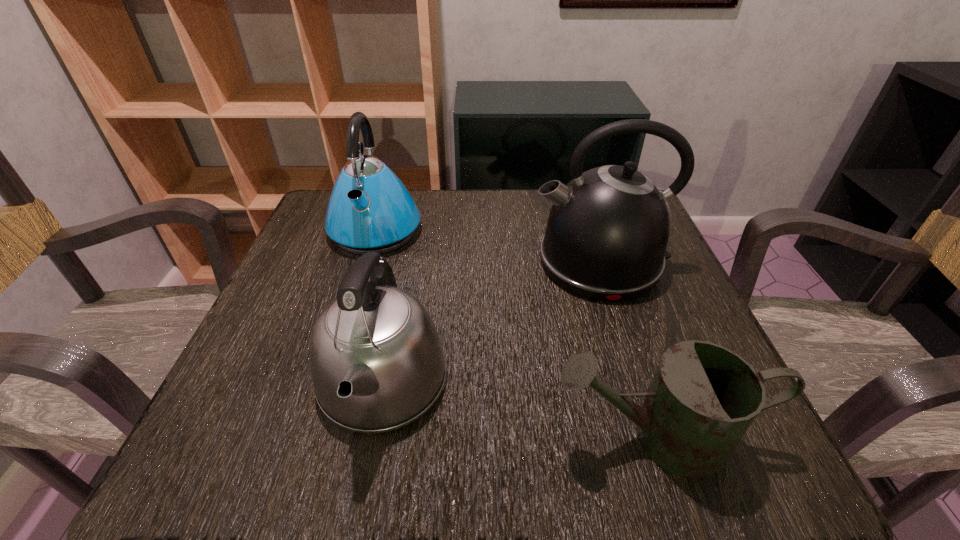
The width and height of the screenshot is (960, 540). In the image, there is a desktop. Find the location of `free space at the near left corner`. free space at the near left corner is located at coordinates (248, 423).

In the image, there is a desktop. Where is `free space at the near right corner`? The width and height of the screenshot is (960, 540). free space at the near right corner is located at coordinates (753, 440).

This screenshot has height=540, width=960. I want to click on free spot between the shortest object and the rightmost kettle, so click(x=628, y=349).

I want to click on empty space that is in between the rightmost kettle and the nearest kettle, so click(x=492, y=321).

The height and width of the screenshot is (540, 960). Identify the location of vacant area that lies between the watering can and the nearest kettle. pyautogui.click(x=519, y=409).

I want to click on unoccupied area between the shortest object and the rightmost kettle, so click(628, 349).

At what (x,y) coordinates should I click in order to perform the action: click on object that can be found as the second closest to the rightmost kettle. Please return your answer as a coordinate pair (x, y). This screenshot has height=540, width=960. Looking at the image, I should click on (703, 397).

The height and width of the screenshot is (540, 960). In order to click on the third closest object to the watering can in this screenshot , I will do `click(370, 210)`.

Where is `kettle that is the second closest to the rightmost kettle`? The image size is (960, 540). kettle that is the second closest to the rightmost kettle is located at coordinates (370, 210).

Identify which kettle is the second closest to the nearest kettle. Please provide its 2D coordinates. Your answer should be formatted as a tuple, i.e. [(x, y)], where the tuple contains the x and y coordinates of a point satisfying the conditions above.

[(370, 210)]